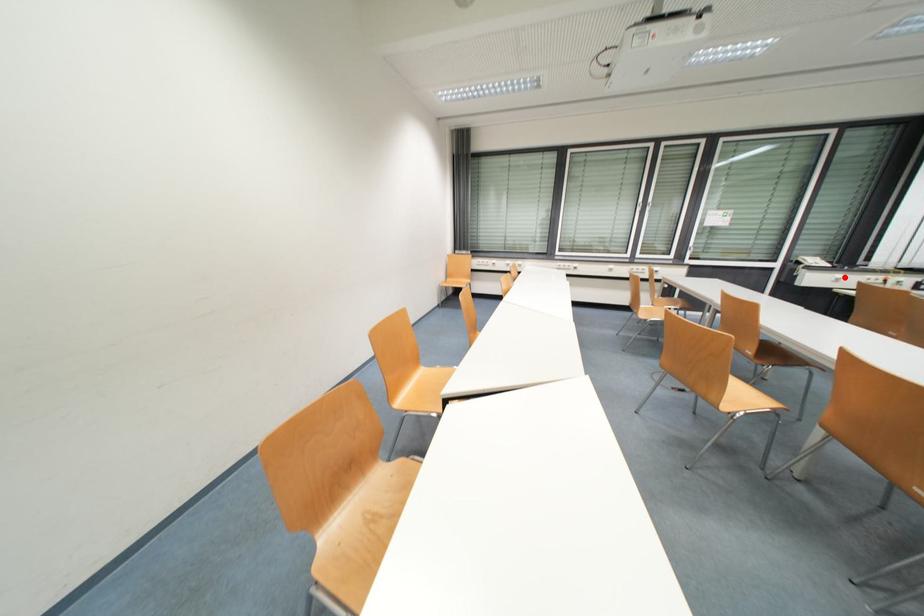
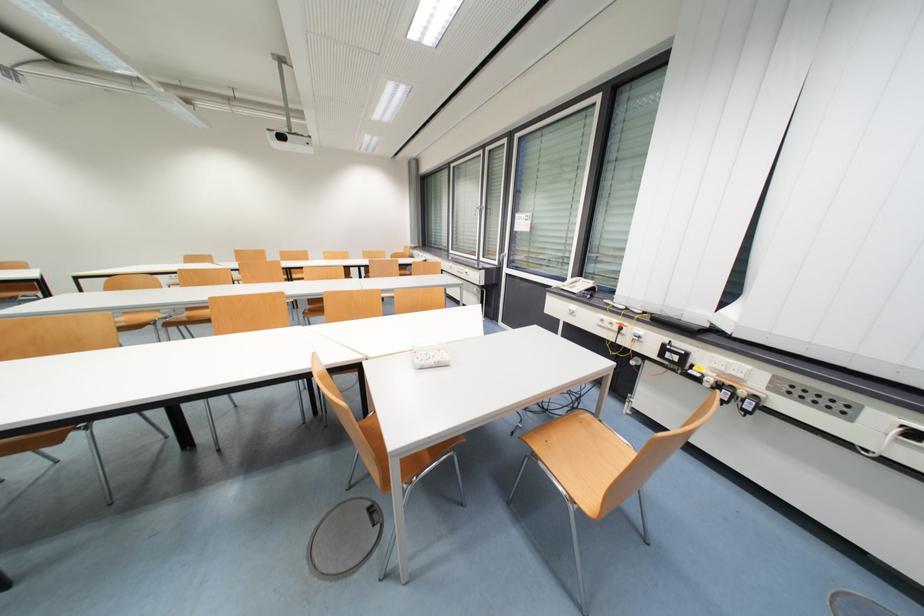
Question: I am providing you with two images of the same scene from different viewpoints. In image1, a red point is highlighted. Considering the same 3D point in image2, which of the following is correct?

Choices:
 (A) It is closer
 (B) It is farther

Answer: (A)